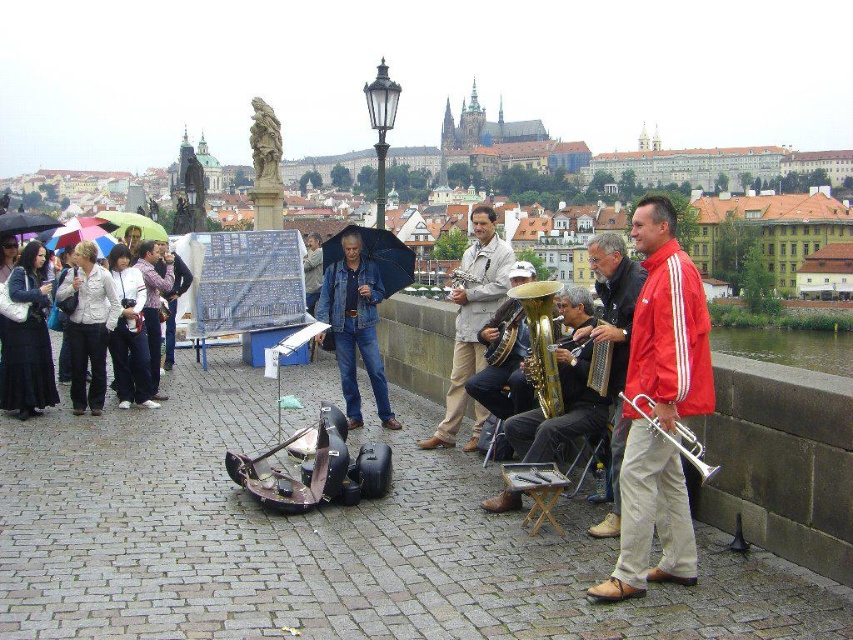
Question: Among these objects, which one is farthest from the camera?

Choices:
 (A) red fabric jacket at right
 (B) black matte umbrella at center
 (C) green matte umbrella at left

Answer: (C)

Question: Which point is closer to the camera?

Choices:
 (A) red smooth jacket at center
 (B) matte purple umbrella at upper left
 (C) gold brass trumpet at center
 (D) silver metallic trumpet at center-right

Answer: (A)

Question: Which object is positioned farthest from the blue jeans at center?

Choices:
 (A) light beige fabric jacket at center
 (B) gold brass tuba at center
 (C) silver metallic trumpet at center-right
 (D) gold brass trumpet at center

Answer: (C)

Question: Can you confirm if red fabric jacket at right is positioned to the left of matte purple umbrella at upper left?

Choices:
 (A) yes
 (B) no

Answer: (B)

Question: Can you confirm if matte purple umbrella at upper left is smaller than metallic accordion at center?

Choices:
 (A) yes
 (B) no

Answer: (B)

Question: Is multicolored fabric umbrella at left positioned in front of metallic accordion at center?

Choices:
 (A) yes
 (B) no

Answer: (B)